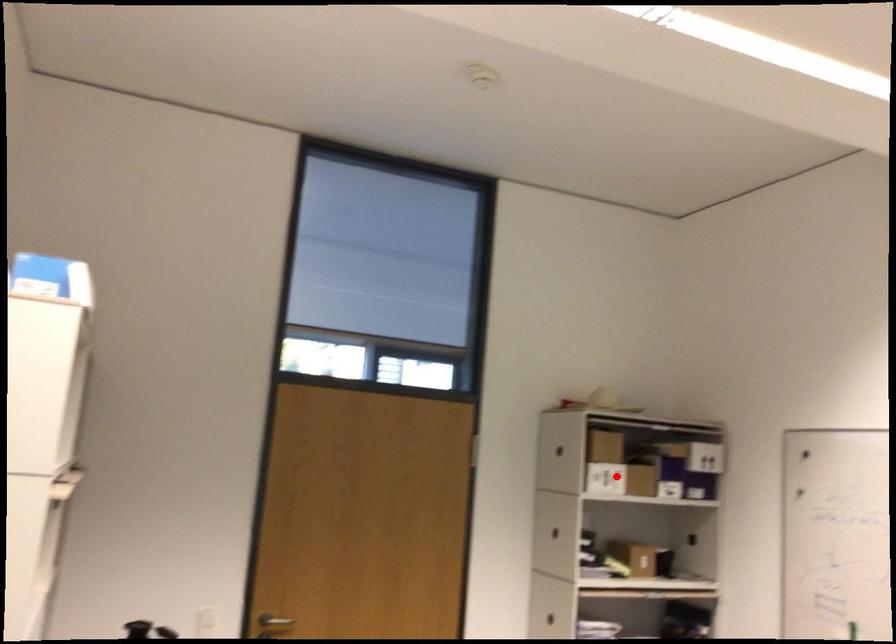
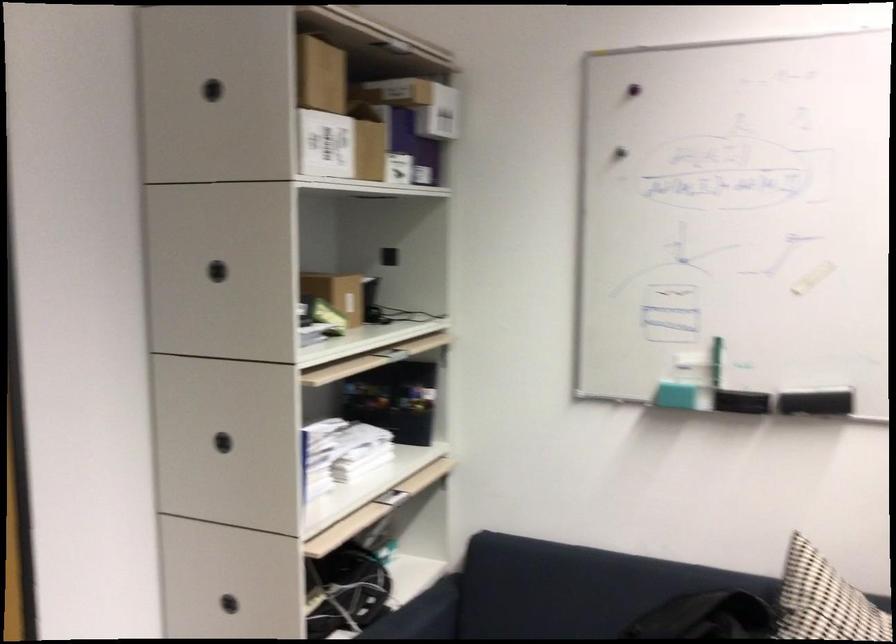
Where in the second image is the point corresponding to the highlighted location from the first image?

(340, 146)